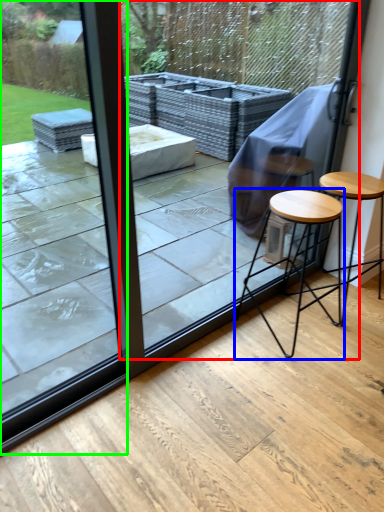
Question: Which object is positioned farthest from screen door (highlighted by a red box)? Select from stool (highlighted by a blue box) and glass door (highlighted by a green box).

Choices:
 (A) stool
 (B) glass door

Answer: (B)